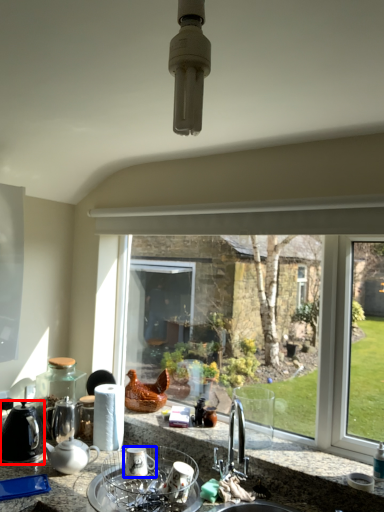
Question: Which point is further to the camera, kitchen appliance (highlighted by a red box) or appliance (highlighted by a blue box)?

Choices:
 (A) kitchen appliance
 (B) appliance

Answer: (A)